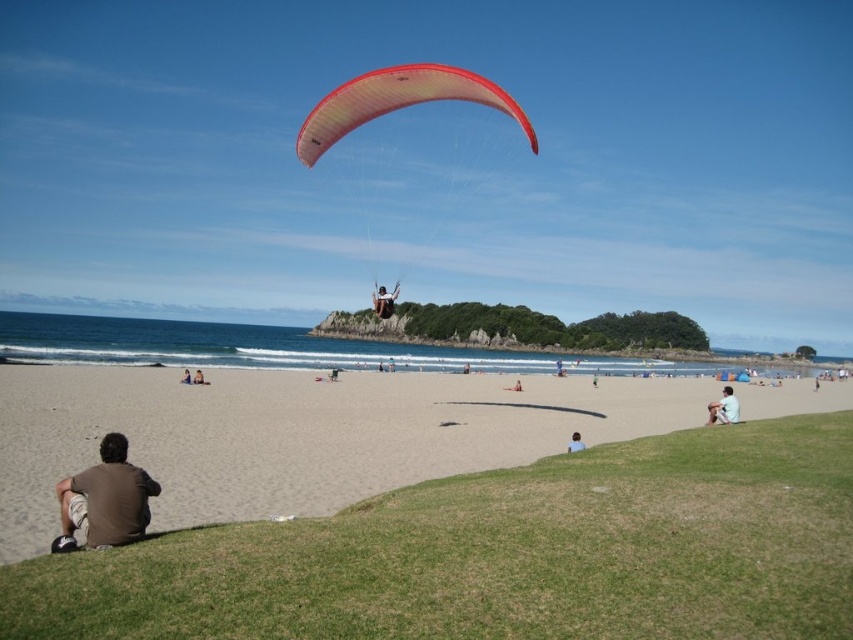
You are a photographer planning to capture a wide shot of the beach scene. You need to ensure that both the beige sand at lower center and the blue fabric person at lower center are fully visible in the frame. Based on their widths, which object should you prioritize positioning closer to the center of the frame to ensure it doesn

The beige sand at lower center has a greater width than the blue fabric person at lower center. To ensure both are fully visible, prioritize positioning the beige sand at lower center closer to the center of the frame since its larger size may require more space to fit within the shot.

You are standing on the beach and see the white cotton shirt at lower right and the blue fabric person at lower center. Which one appears taller from your perspective?

The white cotton shirt at lower right is much taller than the blue fabric person at lower center.